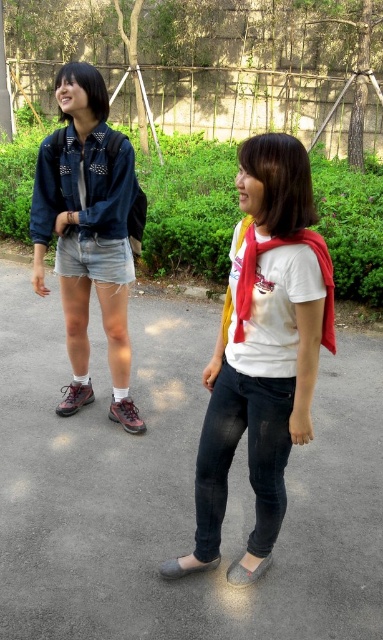
In the scene shown: You are a fashion designer analyzing the clothing items in the image. Which clothing item has a greater width between the denim shorts at left and the gray fabric sandal at lower center?

The denim shorts at left has a greater width than the gray fabric sandal at lower center according to the description.

You are a photographer trying to capture a candid shot of both the denim shorts at left and the gray fabric sandal at lower center. Which object should you focus on first to ensure it appears in the foreground of your photo?

The denim shorts at left should be focused on first because it is closer to the viewer than the gray fabric sandal at lower center, making it naturally appear in the foreground.

You are a photographer setting up a tripod to capture a candid shot of the two people in the scene. The tripod has a minimum required distance of 30 inches between the two subjects to ensure both are in focus. Based on the spacing between the denim jeans at center and gray suede sandal at lower center, will the current positioning allow for a clear, in focus photo of both individuals?

The distance between the denim jeans at center and gray suede sandal at lower center is 28.38 inches, which is less than the tripod minimum required distance of 30 inches. Therefore, the current positioning will not allow for a clear, in focus photo of both individuals.